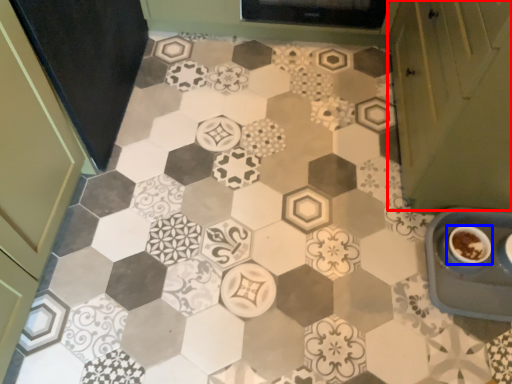
Question: Which object appears farthest to the camera in this image, cabinetry (highlighted by a red box) or coffee cup (highlighted by a blue box)?

Choices:
 (A) cabinetry
 (B) coffee cup

Answer: (B)